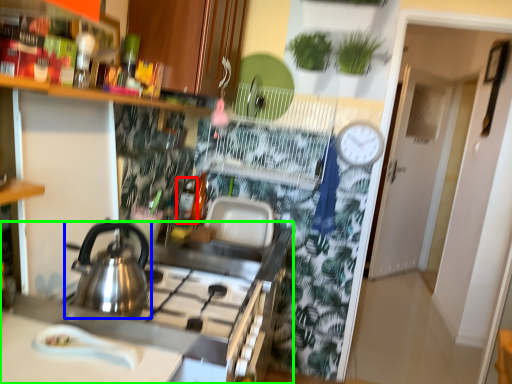
Question: Estimate the real-world distances between objects in this image. Which object is closer to bottle (highlighted by a red box), kettle (highlighted by a blue box) or counter (highlighted by a green box)?

Choices:
 (A) kettle
 (B) counter

Answer: (B)